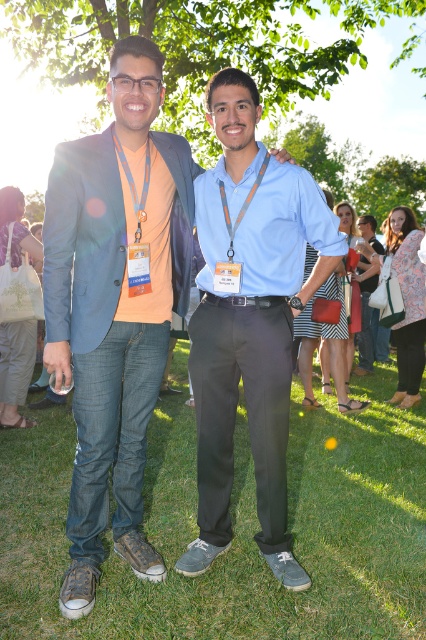
You are a photographer trying to capture a closeup of the orange fabric lanyard at center without including the matte blue blazer at center in the frame. Based on their sizes, is this possible?

The matte blue blazer at center is wider than the orange fabric lanyard at center, so it might be challenging to capture a closeup of the orange fabric lanyard at center without including the matte blue blazer at center in the frame due to its larger size.

Based on the photo, in the scene, there are two people standing under trees. The person on the left is wearing a light blue blazer and has an orange fabric lanyard around their neck. The person on the right is wearing a light blue shirt. From the perspective of someone facing the image, which object is positioned to the right of the other between the light blue shirt at center and the orange fabric lanyard at center?

The light blue shirt at center is to the right of the orange fabric lanyard at center.